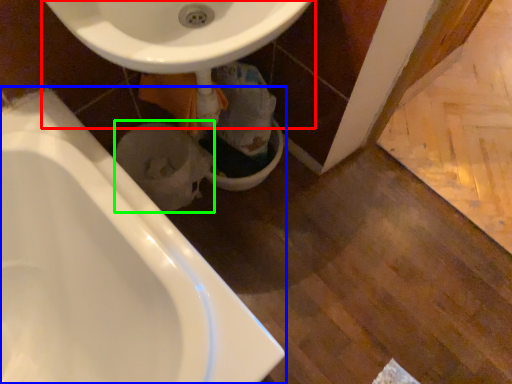
Question: Estimate the real-world distances between objects in this image. Which object is farther from sink (highlighted by a red box), bathtub (highlighted by a blue box) or toilet bowl (highlighted by a green box)?

Choices:
 (A) bathtub
 (B) toilet bowl

Answer: (B)